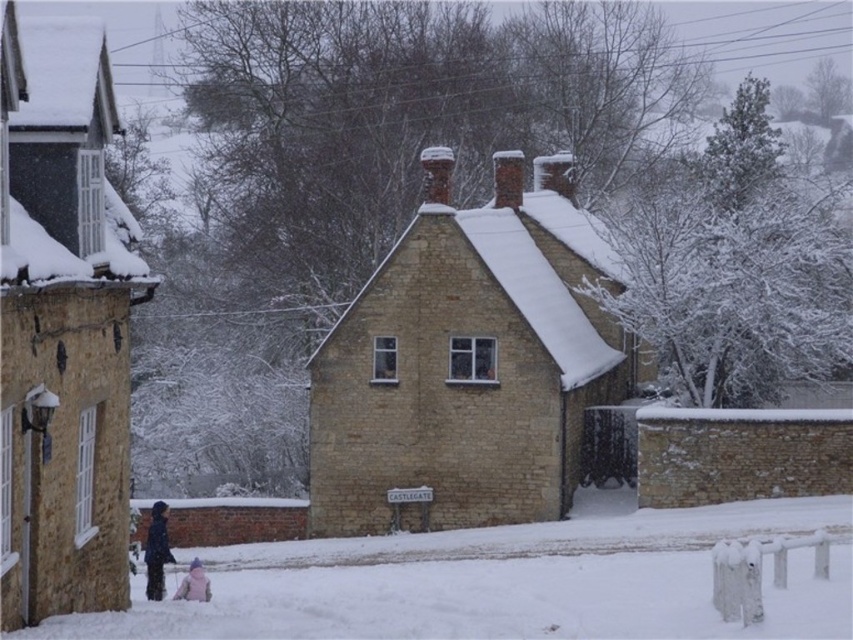
You are standing in the snowy area in front of the cottage and want to greet both the person in the dark blue jacket at lower left and the child in the pink fabric at lower center. Which one should you approach first if you want to greet them in the order closest to farthest from your current position?

You should first greet the person in the dark blue jacket at lower left because they are closer to you than the child in the pink fabric at lower center, as the dark blue jacket at lower left is further to the viewer than pink fabric at lower center.

You are standing at the point with coordinates point (306, 627) and want to walk towards the point with coordinates point (187, 577). Which direction should you face to move towards it?

You should face north to move towards the point (187, 577) from point (306, 627) because it is behind the starting point.

Looking at this image, you are standing at the point marked as point (149, 586) in the winter scene. The cottage is in front of you. If you want to walk directly towards the cottage, which direction should you move?

Since the point (149, 586) is 26.36 meters away from the viewer, you should move forward towards the cottage to get closer.